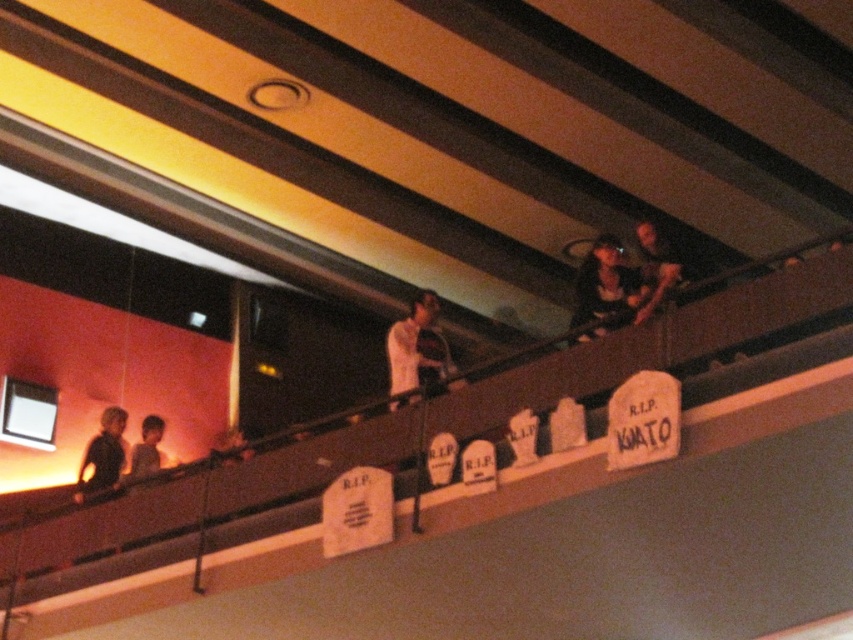
Question: Which of the following is the farthest from the observer?

Choices:
 (A) white matte shirt at center
 (B) smooth skin face at center

Answer: (A)

Question: Which point appears closest to the camera in this image?

Choices:
 (A) (680, 272)
 (B) (576, 305)
 (C) (402, 340)

Answer: (A)

Question: Based on their relative distances, which object is nearer to the black matte shirt at left?

Choices:
 (A) smooth skin face at center
 (B) smooth skin child at lower left

Answer: (B)

Question: Can you confirm if white matte shirt at center is thinner than smooth skin face at upper right?

Choices:
 (A) yes
 (B) no

Answer: (B)

Question: Is black matte dress at upper center to the left of black matte shirt at left from the viewer's perspective?

Choices:
 (A) yes
 (B) no

Answer: (B)

Question: Can you confirm if smooth skin face at upper right is positioned to the left of smooth skin face at center?

Choices:
 (A) no
 (B) yes

Answer: (A)